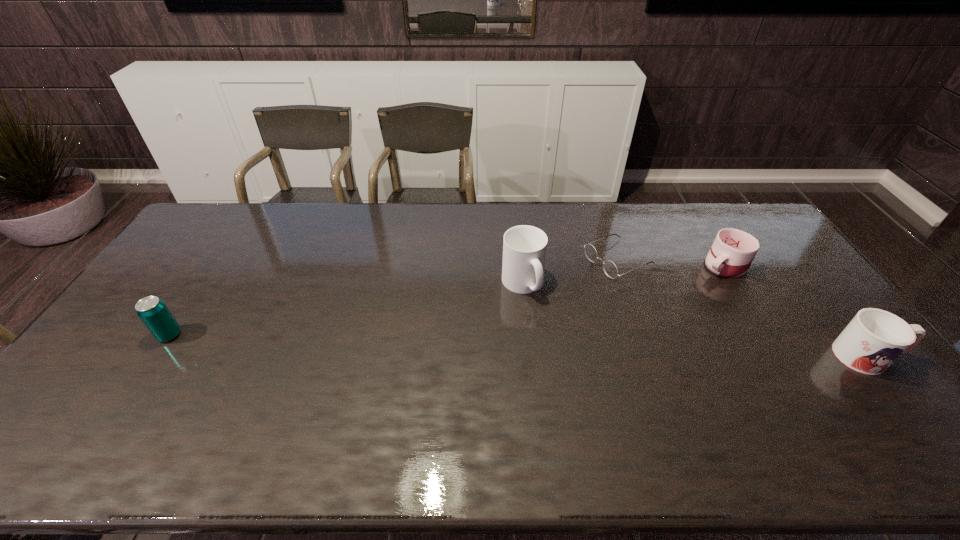
Locate an element on the screen. This screenshot has height=540, width=960. vacant region located on the handle side of the tallest mug is located at coordinates (571, 337).

The width and height of the screenshot is (960, 540). In order to click on vacant space situated 0.220m on the handle side of the tallest mug in this screenshot , I will do `click(584, 349)`.

The height and width of the screenshot is (540, 960). What are the coordinates of `free space located 0.250m on the handle side of the tallest mug` in the screenshot? It's located at (590, 356).

Where is `vacant space situated on the side with the handle of the fourth object from left to right`? The image size is (960, 540). vacant space situated on the side with the handle of the fourth object from left to right is located at coordinates (668, 296).

Where is `vacant space located on the side with the handle of the fourth object from left to right`? The width and height of the screenshot is (960, 540). vacant space located on the side with the handle of the fourth object from left to right is located at coordinates (635, 316).

Find the location of a particular element. vacant area situated on the side with the handle of the fourth object from left to right is located at coordinates (693, 282).

Find the location of a particular element. The height and width of the screenshot is (540, 960). vacant position located 0.190m on the front-facing side of the third object from right to left is located at coordinates (544, 292).

Where is `vacant area situated 0.380m on the front-facing side of the third object from right to left`? Image resolution: width=960 pixels, height=540 pixels. vacant area situated 0.380m on the front-facing side of the third object from right to left is located at coordinates (492, 315).

The width and height of the screenshot is (960, 540). Find the location of `vacant space situated 0.390m on the front-facing side of the third object from right to left`. vacant space situated 0.390m on the front-facing side of the third object from right to left is located at coordinates (490, 316).

The image size is (960, 540). Find the location of `object located in the far edge section of the desktop`. object located in the far edge section of the desktop is located at coordinates (610, 268).